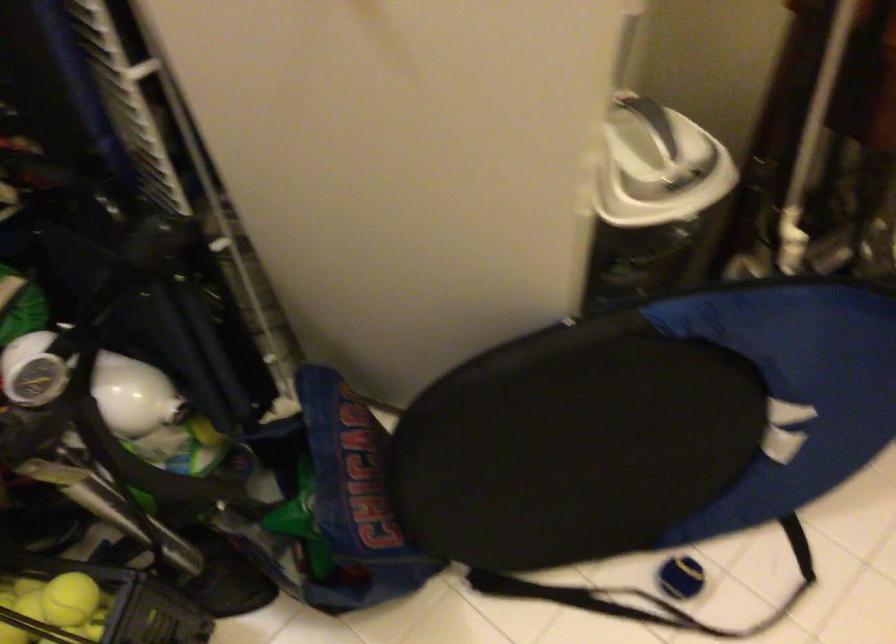
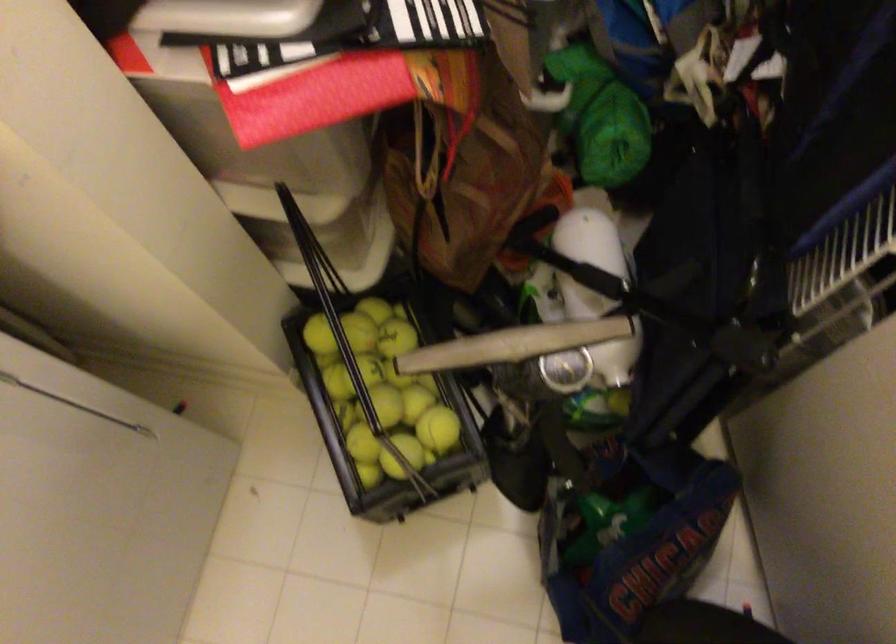
Where in the second image is the point corresponding to [314,520] from the first image?

(607, 522)